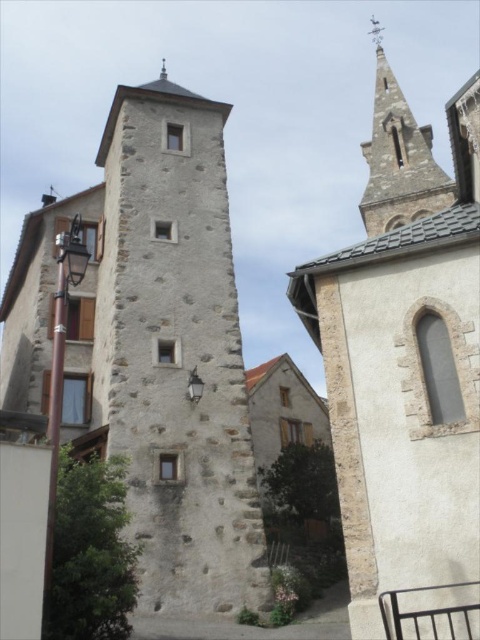
You are an architect analyzing the village layout. You need to determine which structure has a greater width between the stone steeple at upper right and the stone tower at center. Based on the scene, which one is wider?

The stone steeple at upper right is wider than the stone tower at center according to the description.